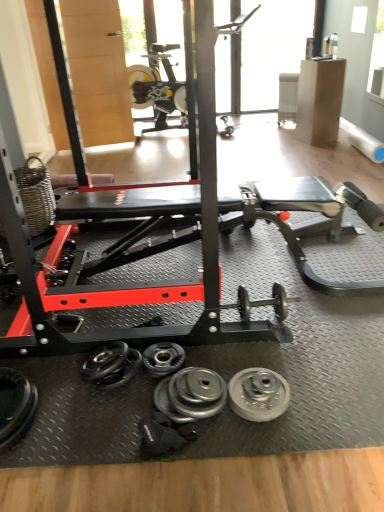
Question: Which direction should I rotate to face silver metallic dumbbell at center, which is the first dumbbell from right to left, — up or down?

Choices:
 (A) down
 (B) up

Answer: (A)

Question: Is silver metallic dumbbell at center, which is the first dumbbell from right to left, inside silver metallic weight at center, arranged as the second wheel when viewed from the left?

Choices:
 (A) yes
 (B) no

Answer: (B)

Question: Is silver metallic weight at center, the 1th wheel in the right-to-left sequence, thinner than silver metallic dumbbell at center, acting as the third dumbbell starting from the left?

Choices:
 (A) no
 (B) yes

Answer: (A)

Question: Can we say silver metallic weight at center, the 1th wheel in the right-to-left sequence, lies outside silver metallic dumbbell at center, which is the first dumbbell from right to left?

Choices:
 (A) yes
 (B) no

Answer: (A)

Question: Can you confirm if silver metallic weight at center, arranged as the second wheel when viewed from the left, is wider than silver metallic dumbbell at center, which is the first dumbbell from right to left?

Choices:
 (A) yes
 (B) no

Answer: (A)

Question: Is silver metallic weight at center, arranged as the second wheel when viewed from the left, shorter than silver metallic dumbbell at center, which is the first dumbbell from right to left?

Choices:
 (A) no
 (B) yes

Answer: (B)

Question: Is the position of silver metallic weight at center, the 1th wheel in the right-to-left sequence, more distant than that of silver metallic dumbbell at center, acting as the third dumbbell starting from the left?

Choices:
 (A) yes
 (B) no

Answer: (B)

Question: Is silver metallic dumbbell at center, which is the first dumbbell from right to left, at the right side of transparent glass window at upper center?

Choices:
 (A) no
 (B) yes

Answer: (A)

Question: Considering the relative sizes of silver metallic dumbbell at center, which is the first dumbbell from right to left, and transparent glass window at upper center in the image provided, is silver metallic dumbbell at center, which is the first dumbbell from right to left, shorter than transparent glass window at upper center?

Choices:
 (A) no
 (B) yes

Answer: (B)

Question: From a real-world perspective, is silver metallic dumbbell at center, acting as the third dumbbell starting from the left, positioned under transparent glass window at upper center based on gravity?

Choices:
 (A) no
 (B) yes

Answer: (B)

Question: Considering the relative sizes of silver metallic dumbbell at center, acting as the third dumbbell starting from the left, and transparent glass window at upper center in the image provided, is silver metallic dumbbell at center, acting as the third dumbbell starting from the left, thinner than transparent glass window at upper center?

Choices:
 (A) no
 (B) yes

Answer: (B)

Question: Does silver metallic dumbbell at center, acting as the third dumbbell starting from the left, appear on the left side of transparent glass window at upper center?

Choices:
 (A) no
 (B) yes

Answer: (B)

Question: Is silver metallic dumbbell at center, which is the first dumbbell from right to left, bigger than transparent glass window at upper center?

Choices:
 (A) yes
 (B) no

Answer: (B)

Question: Does silver metallic dumbbell at lower left, arranged as the first dumbbell when viewed from the left, appear on the left side of silver metallic dumbbell at center, acting as the third dumbbell starting from the left?

Choices:
 (A) no
 (B) yes

Answer: (B)